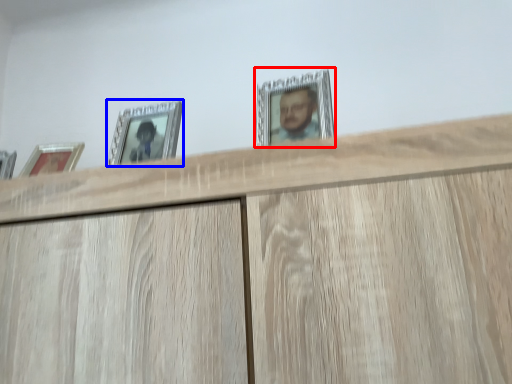
Question: Which object is further to the camera taking this photo, picture frame (highlighted by a red box) or picture frame (highlighted by a blue box)?

Choices:
 (A) picture frame
 (B) picture frame

Answer: (B)